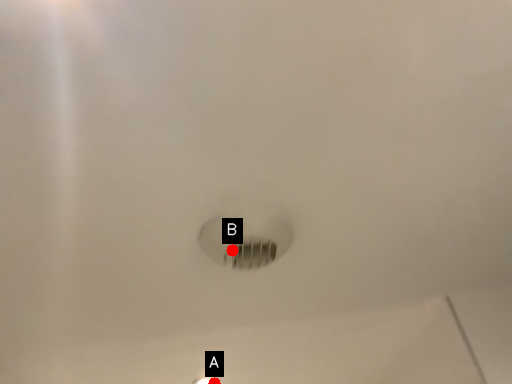
Question: Two points are circled on the image, labeled by A and B beside each circle. Among these points, which one is farthest from the camera?

Choices:
 (A) A is further
 (B) B is further

Answer: (A)